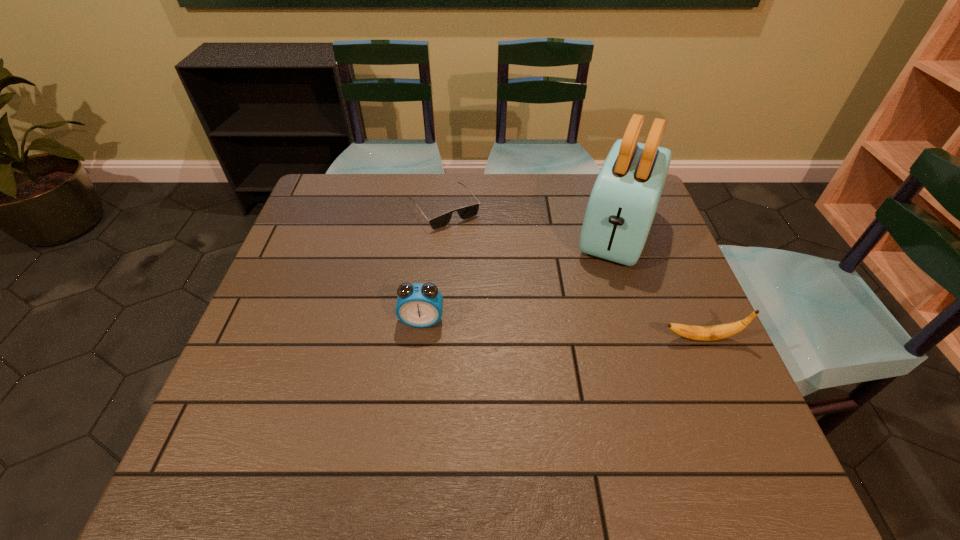
Where is `free region located 0.180m on the front-facing side of the sunglasses`? This screenshot has height=540, width=960. free region located 0.180m on the front-facing side of the sunglasses is located at coordinates (492, 267).

Locate an element on the screen. free location located on the front-facing side of the sunglasses is located at coordinates (514, 294).

Find the location of a particular element. blank space located 0.050m on the front-facing side of the sunglasses is located at coordinates (468, 239).

You are a GUI agent. You are given a task and a screenshot of the screen. Output one action in this format:
    pyautogui.click(x=<x>, y=<y>)
    Task: Click on the free region located on the side of the toaster with the lever
    The image size is (960, 540).
    Given the screenshot: What is the action you would take?
    pyautogui.click(x=586, y=331)

Locate an element on the screen. The width and height of the screenshot is (960, 540). vacant space situated 0.300m on the side of the toaster with the lever is located at coordinates (576, 357).

I want to click on free space located on the side of the toaster with the lever, so click(x=601, y=291).

Identify the location of sunglasses located in the far edge section of the desktop. (467, 212).

At what (x,y) coordinates should I click in order to perform the action: click on toaster at the far edge. Please return your answer as a coordinate pair (x, y). The image size is (960, 540). Looking at the image, I should click on (624, 199).

The image size is (960, 540). In order to click on banana present at the right edge in this screenshot , I will do `click(702, 333)`.

Image resolution: width=960 pixels, height=540 pixels. In order to click on toaster located in the right edge section of the desktop in this screenshot , I will do `click(624, 199)`.